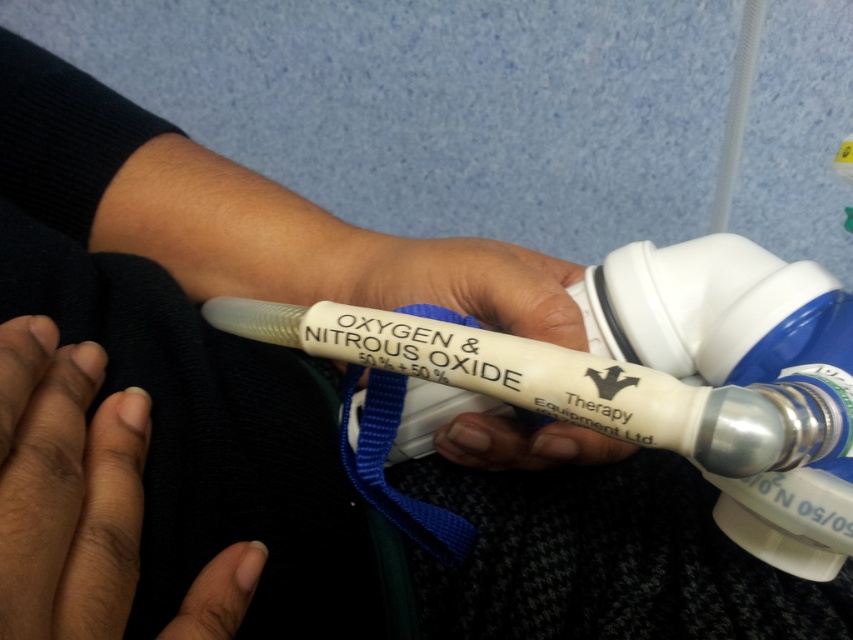
Can you confirm if dark skin at lower left is positioned to the right of white matte oxygen mask at center?

In fact, dark skin at lower left is to the left of white matte oxygen mask at center.

Between point (90, 518) and point (502, 250), which one is positioned in front?

Positioned in front is point (90, 518).

Where is `dark skin at lower left`? dark skin at lower left is located at coordinates (67, 486).